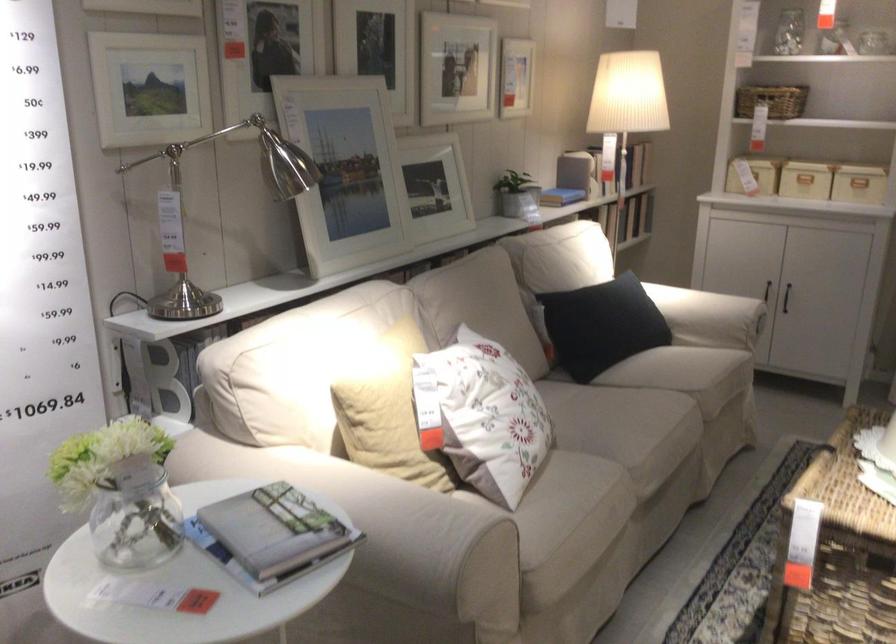
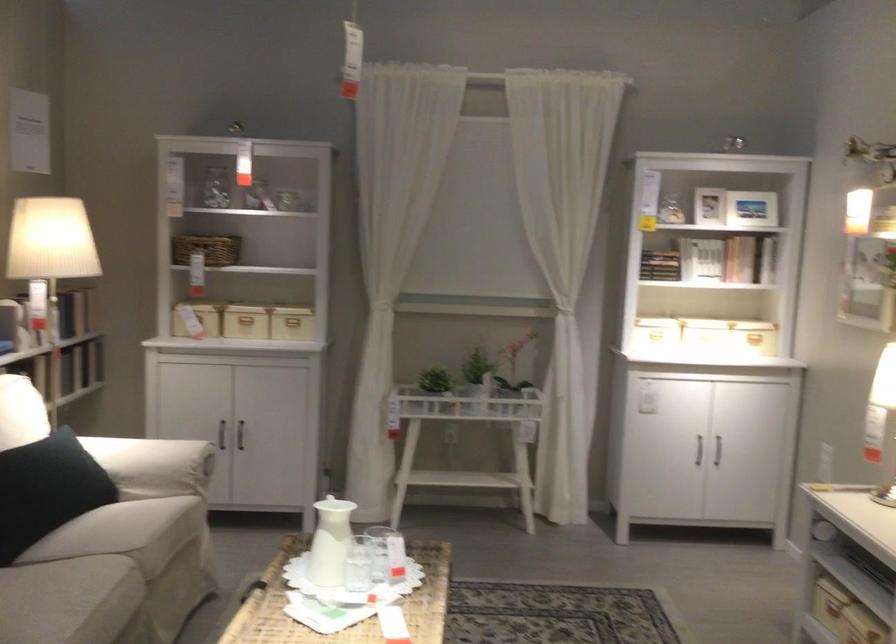
Question: How did the camera likely rotate?

Choices:
 (A) Left
 (B) Right
 (C) Up
 (D) Down

Answer: (B)